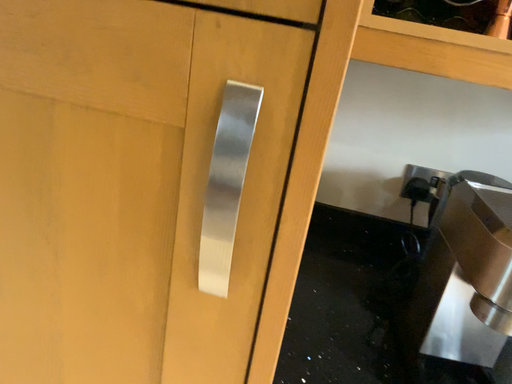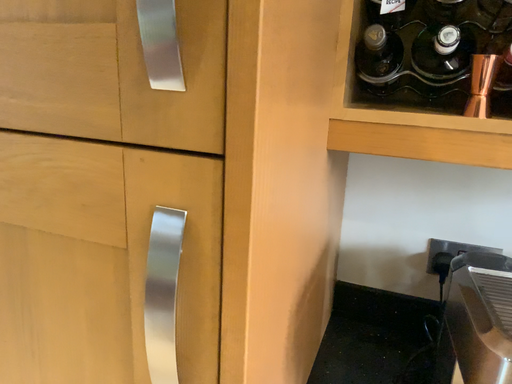
Question: Which way did the camera rotate in the video?

Choices:
 (A) rotated left
 (B) rotated right

Answer: (A)